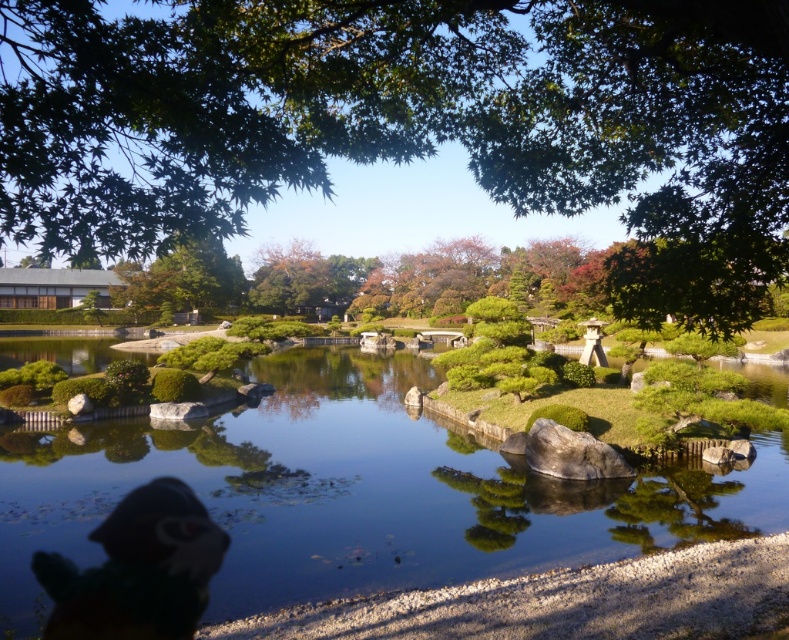
Does multicolored plush toy at lower left have a lesser height compared to gray smooth rock at center?

Correct, multicolored plush toy at lower left is not as tall as gray smooth rock at center.

Which is more to the left, multicolored plush toy at lower left or gray smooth rock at center?

gray smooth rock at center is more to the left.

Describe the element at coordinates (137, 570) in the screenshot. I see `multicolored plush toy at lower left` at that location.

The image size is (789, 640). Find the location of `multicolored plush toy at lower left`. multicolored plush toy at lower left is located at coordinates (137, 570).

Can you confirm if green leafy tree at upper center is wider than multicolored plush toy at lower left?

Indeed, green leafy tree at upper center has a greater width compared to multicolored plush toy at lower left.

Between point (703, 236) and point (109, 528), which one is positioned behind?

Positioned behind is point (109, 528).

This screenshot has height=640, width=789. In order to click on green leafy tree at upper center in this screenshot , I will do `click(410, 122)`.

Can you confirm if green leafy tree at upper center is shorter than clear water at center?

In fact, green leafy tree at upper center may be taller than clear water at center.

The width and height of the screenshot is (789, 640). Describe the element at coordinates (410, 122) in the screenshot. I see `green leafy tree at upper center` at that location.

Where is `green leafy tree at upper center`? This screenshot has width=789, height=640. green leafy tree at upper center is located at coordinates (410, 122).